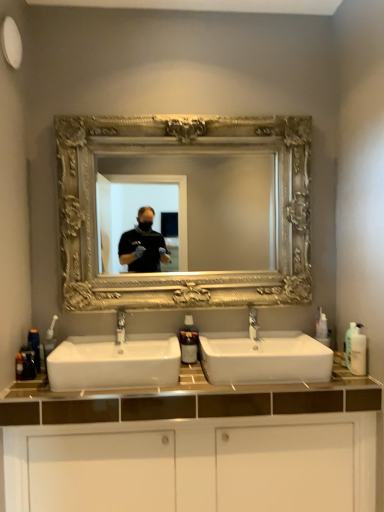
In order to click on vacant area situated to the left side of white plastic bottle at right, arranged as the 3th toiletry when viewed from the left in this screenshot , I will do `click(329, 376)`.